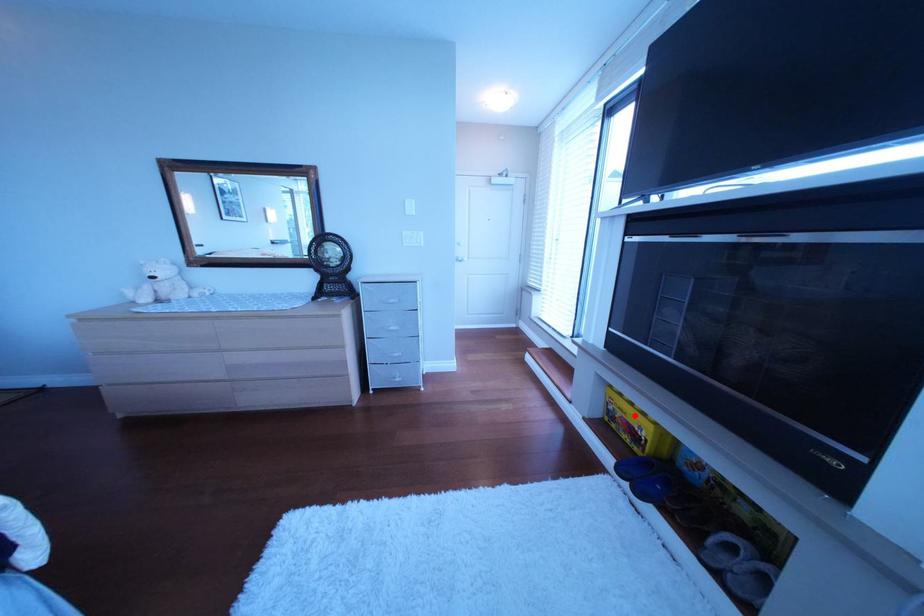
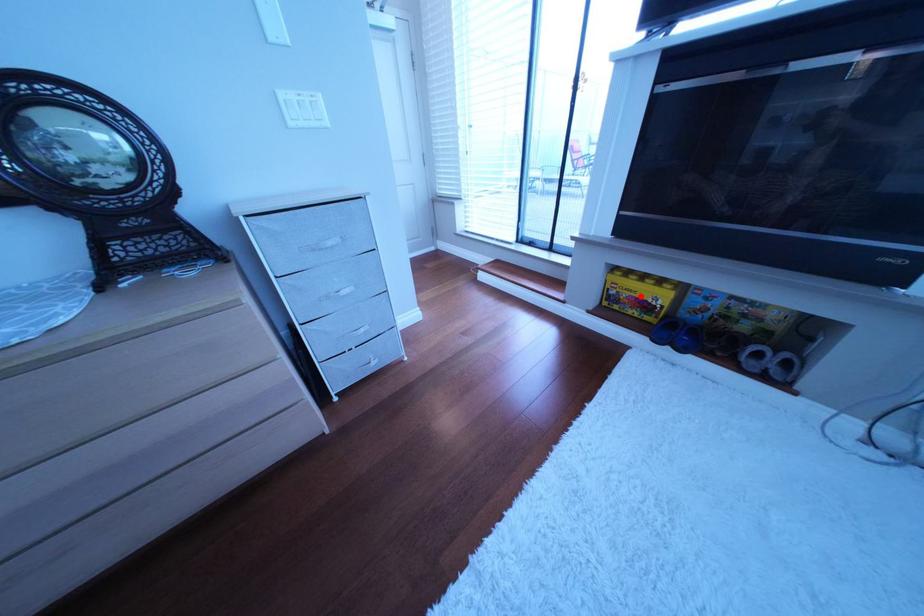
I am providing you with two images of the same scene from different viewpoints. A red point is marked on the first image and another point is marked on the second image. Do the highlighted points in image1 and image2 indicate the same real-world spot?

Yes